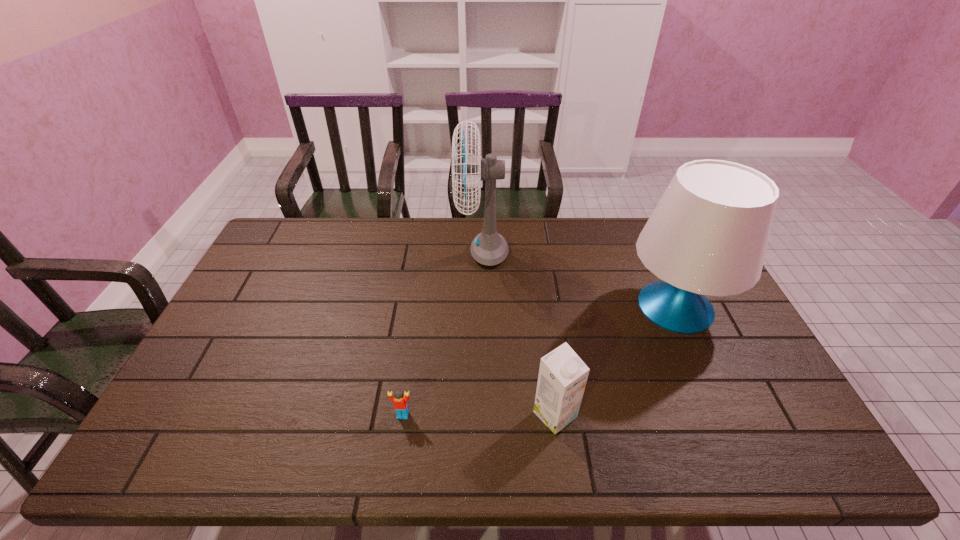
Identify the location of free spot between the table lamp and the third object from right to left. (579, 279).

You are a GUI agent. You are given a task and a screenshot of the screen. Output one action in this format:
    pyautogui.click(x=<x>, y=<y>)
    Task: Click on the unoccupied position between the Lego and the fan
    The width and height of the screenshot is (960, 540).
    Given the screenshot: What is the action you would take?
    pyautogui.click(x=443, y=333)

This screenshot has height=540, width=960. What are the coordinates of `object identified as the third closest to the third object from left to right` in the screenshot? It's located at [x=489, y=248].

Locate an element on the screen. The width and height of the screenshot is (960, 540). the third closest object relative to the fan is located at coordinates (400, 401).

Image resolution: width=960 pixels, height=540 pixels. What are the coordinates of `vacant space that satisfies the following two spatial constraints: 1. on the front-facing side of the table lamp; 2. on the face of the shortest object` in the screenshot? It's located at (725, 415).

Identify the location of vacant space that satisfies the following two spatial constraints: 1. on the front-facing side of the third object from right to left; 2. on the right side of the carton. (484, 415).

Image resolution: width=960 pixels, height=540 pixels. What are the coordinates of `free space that satisfies the following two spatial constraints: 1. on the front-facing side of the third object from right to left; 2. on the face of the leftmost object` in the screenshot? It's located at (484, 415).

I want to click on vacant position in the image that satisfies the following two spatial constraints: 1. on the front-facing side of the carton; 2. on the right side of the fan, so click(484, 415).

Identify the location of vacant region that satisfies the following two spatial constraints: 1. on the front-facing side of the third object from right to left; 2. on the face of the leftmost object. The height and width of the screenshot is (540, 960). (484, 415).

The height and width of the screenshot is (540, 960). Find the location of `free spot that satisfies the following two spatial constraints: 1. on the front-facing side of the third object from right to left; 2. on the back side of the carton`. free spot that satisfies the following two spatial constraints: 1. on the front-facing side of the third object from right to left; 2. on the back side of the carton is located at coordinates (484, 415).